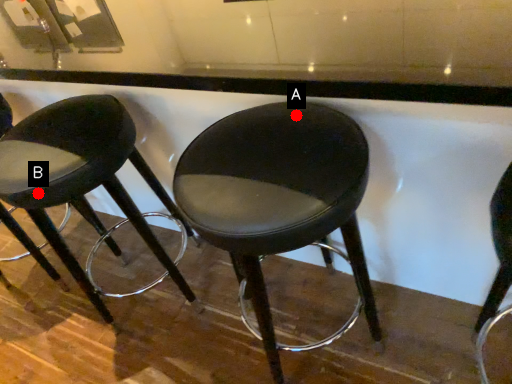
Question: Two points are circled on the image, labeled by A and B beside each circle. Which point is further to the camera?

Choices:
 (A) A is further
 (B) B is further

Answer: (B)